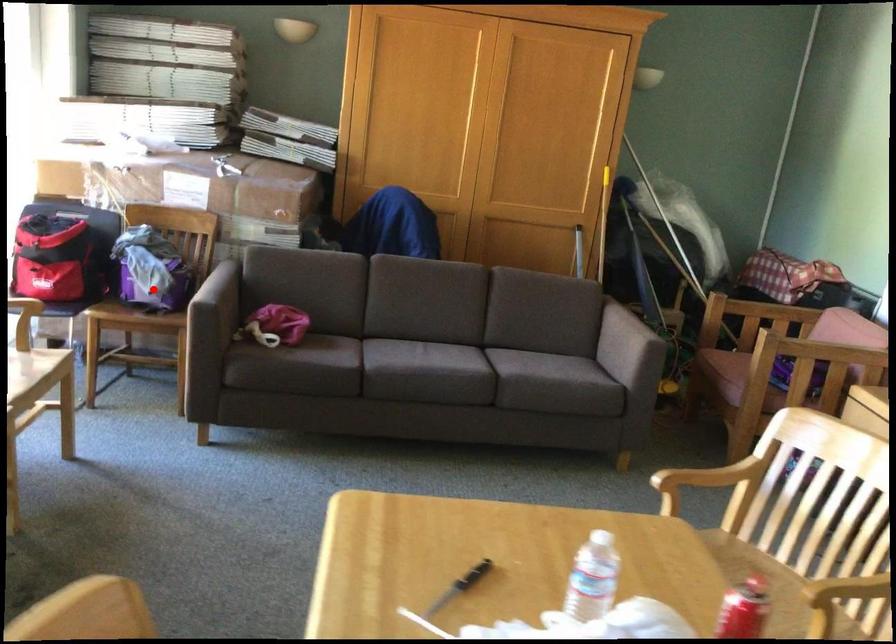
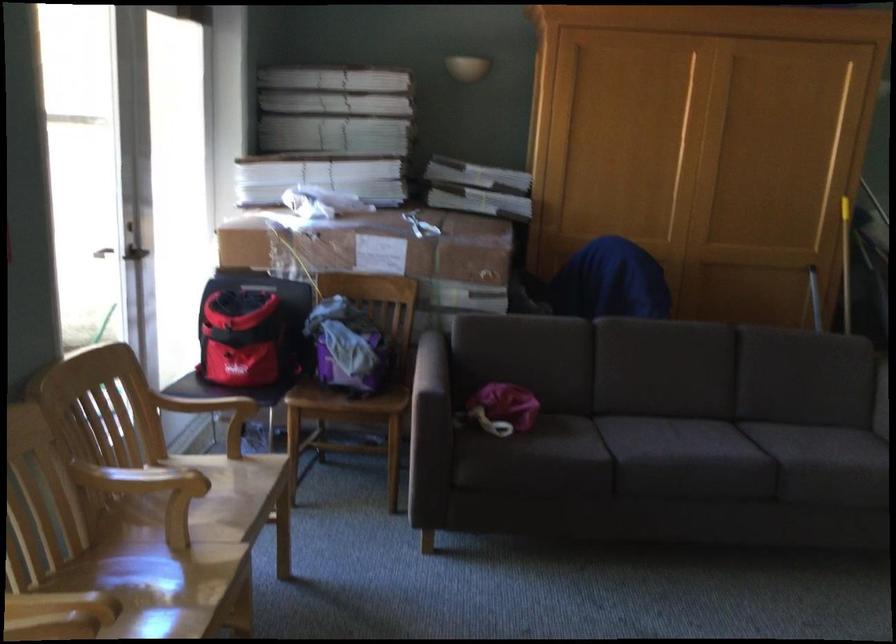
Locate, in the second image, the point that corresponds to the highlighted location in the first image.

(352, 366)